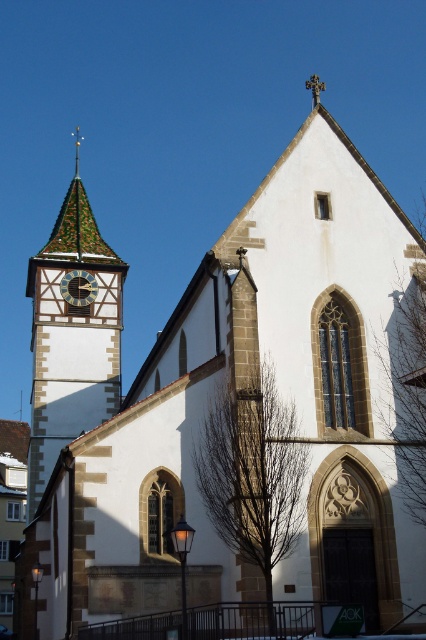
You are standing in front of the church and notice a specific point marked at coordinates point [71,337]. Based on the scene description, can you identify which part of the church this point corresponds to?

The point [71,337] is on the greenish brown tiled roof of the clock tower on the left side of the church.